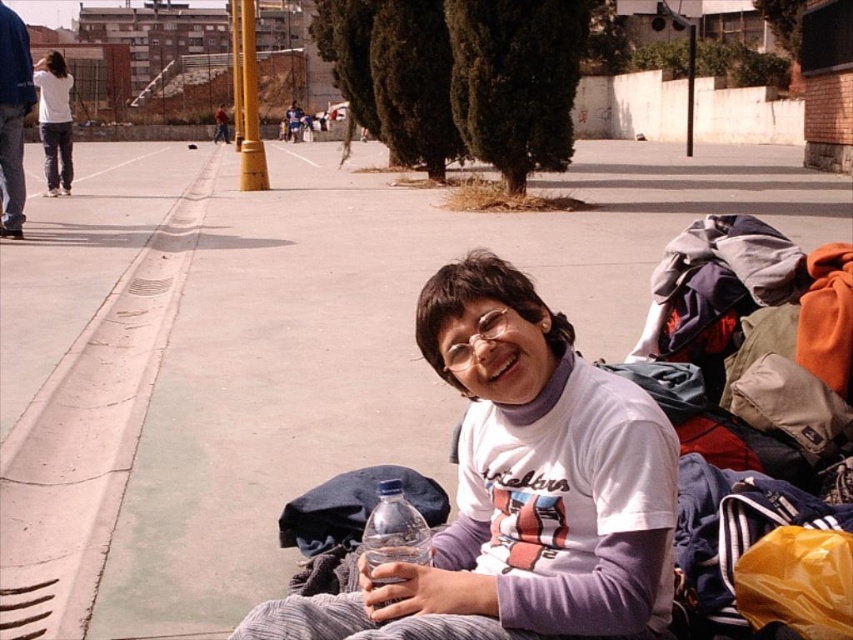
Question: Does brushed metal jacket at upper left have a smaller size compared to brown leather jacket at upper center?

Choices:
 (A) yes
 (B) no

Answer: (A)

Question: Does clear plastic bottle at lower center appear on the left side of matte white shirt at upper left?

Choices:
 (A) no
 (B) yes

Answer: (A)

Question: Which is nearer to the matte white shirt at upper left?

Choices:
 (A) brown leather jacket at upper center
 (B) brushed metal jacket at upper left

Answer: (B)

Question: Is white matte t-shirt at center positioned at the back of matte white shirt at upper left?

Choices:
 (A) yes
 (B) no

Answer: (B)

Question: Which object is positioned farthest from the brushed metal jacket at upper left?

Choices:
 (A) brown leather jacket at upper center
 (B) clear plastic bottle at lower center
 (C) concrete at left
 (D) matte white shirt at upper left

Answer: (A)

Question: Among these points, which one is nearest to the camera?

Choices:
 (A) pos(51,115)
 (B) pos(10,186)
 (C) pos(102,369)
 (D) pos(660,627)

Answer: (D)